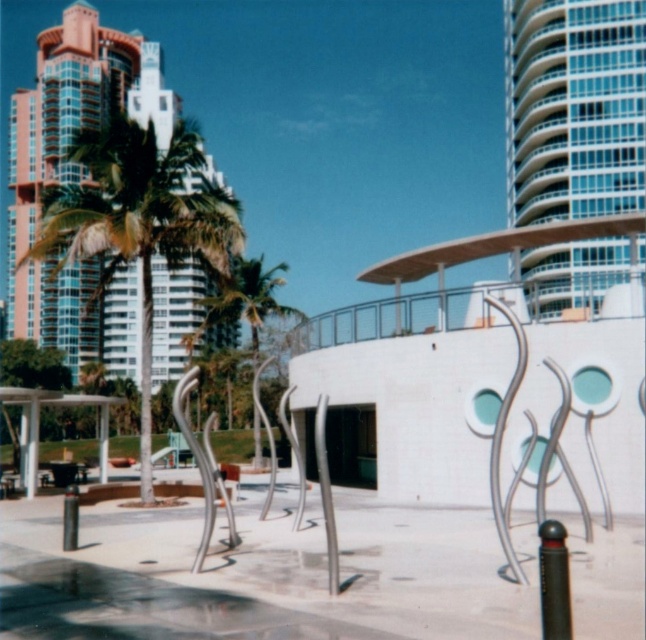
Question: Can you confirm if green leafy palm tree at left is positioned above green leafy palm tree at center?

Choices:
 (A) no
 (B) yes

Answer: (B)

Question: Where is green leafy palm tree at left located in relation to green leafy palm tree at center in the image?

Choices:
 (A) right
 (B) left

Answer: (B)

Question: Which object is closer to the camera taking this photo?

Choices:
 (A) green leafy palm tree at left
 (B) green leafy palm tree at center

Answer: (A)

Question: Does green leafy palm tree at left have a lesser width compared to green leafy palm tree at center?

Choices:
 (A) yes
 (B) no

Answer: (B)